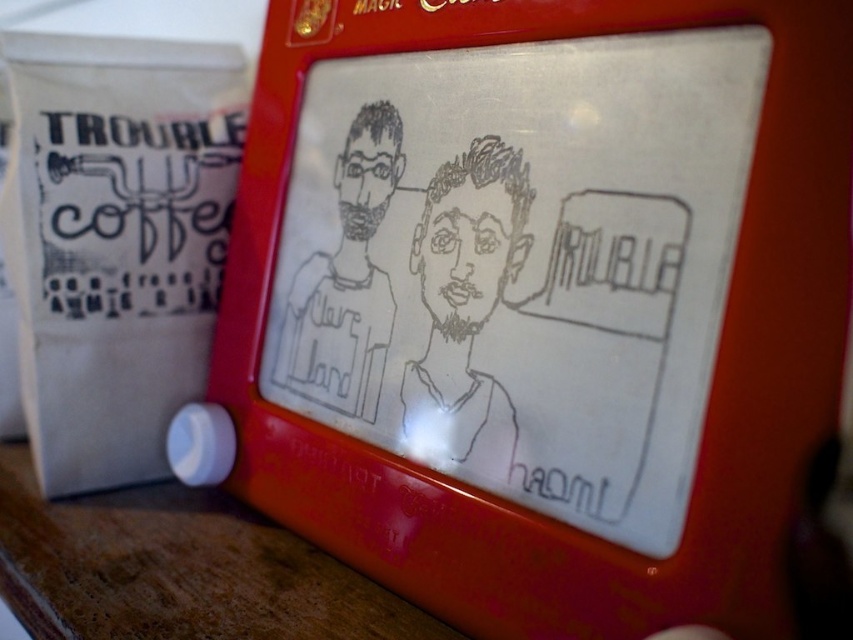
Question: Which of the following is the closest to the observer?

Choices:
 (A) black ink drawing of man at center
 (B) black line drawing face at center

Answer: (B)

Question: Can you confirm if black line drawing face at center is smaller than black ink drawing of man at center?

Choices:
 (A) no
 (B) yes

Answer: (B)

Question: Which point appears closest to the camera in this image?

Choices:
 (A) (463, 198)
 (B) (288, 324)

Answer: (A)

Question: Is black line drawing face at center thinner than black ink drawing of man at center?

Choices:
 (A) yes
 (B) no

Answer: (A)

Question: Is black line drawing face at center to the left of black ink drawing of man at center from the viewer's perspective?

Choices:
 (A) no
 (B) yes

Answer: (A)